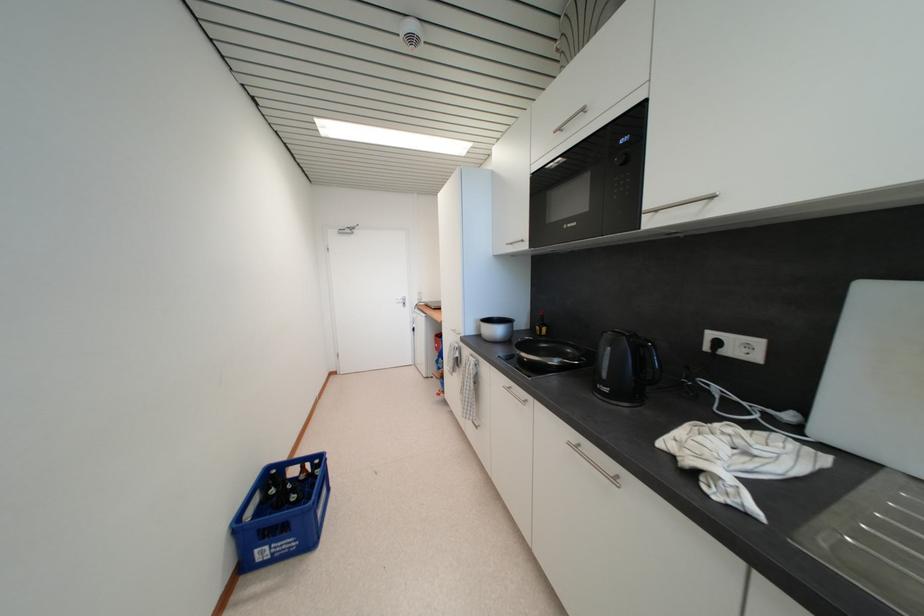
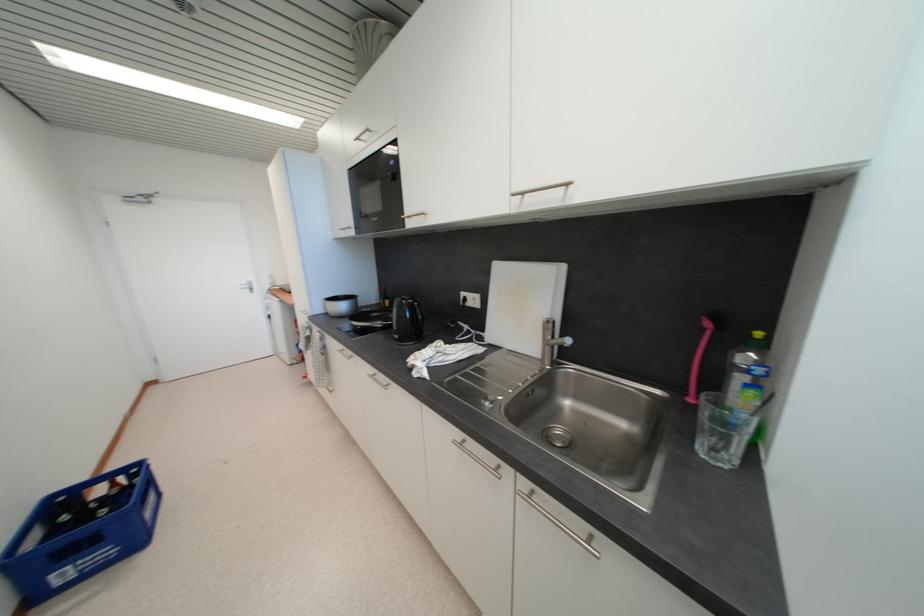
In the second image, find the point that corresponds to the point at 505,355 in the first image.

(351, 328)